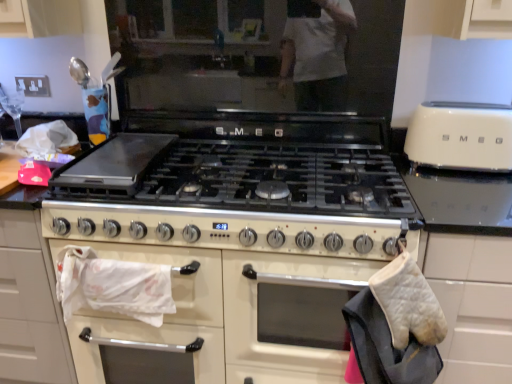
Question: Would you say white quilted oven mitt at right is a long distance from white glossy oven at center?

Choices:
 (A) yes
 (B) no

Answer: (B)

Question: Is white quilted oven mitt at right directly adjacent to white glossy oven at center?

Choices:
 (A) yes
 (B) no

Answer: (B)

Question: Is white quilted oven mitt at right closer to the viewer compared to white glossy oven at center?

Choices:
 (A) no
 (B) yes

Answer: (B)

Question: From the image's perspective, is white quilted oven mitt at right over white glossy oven at center?

Choices:
 (A) yes
 (B) no

Answer: (A)

Question: Is white quilted oven mitt at right shorter than white glossy oven at center?

Choices:
 (A) no
 (B) yes

Answer: (B)

Question: Relative to ivory matte toaster at right, is white glossy oven at center in front or behind?

Choices:
 (A) front
 (B) behind

Answer: (A)

Question: In terms of width, does white glossy oven at center look wider or thinner when compared to ivory matte toaster at right?

Choices:
 (A) wide
 (B) thin

Answer: (A)

Question: From a real-world perspective, is white glossy oven at center above or below ivory matte toaster at right?

Choices:
 (A) below
 (B) above

Answer: (A)

Question: In terms of height, does white glossy oven at center look taller or shorter compared to ivory matte toaster at right?

Choices:
 (A) tall
 (B) short

Answer: (A)

Question: Is white glossy oven at center bigger or smaller than white quilted oven mitt at right?

Choices:
 (A) small
 (B) big

Answer: (B)

Question: From a real-world perspective, is white glossy oven at center positioned above or below white quilted oven mitt at right?

Choices:
 (A) below
 (B) above

Answer: (A)

Question: In the image, is white glossy oven at center on the left side or the right side of white quilted oven mitt at right?

Choices:
 (A) right
 (B) left

Answer: (B)

Question: Is white glossy oven at center taller or shorter than white quilted oven mitt at right?

Choices:
 (A) tall
 (B) short

Answer: (A)

Question: From their relative heights in the image, would you say ivory matte toaster at right is taller or shorter than white quilted oven mitt at right?

Choices:
 (A) short
 (B) tall

Answer: (A)

Question: Considering the positions of point (497, 124) and point (399, 367), is point (497, 124) closer or farther from the camera than point (399, 367)?

Choices:
 (A) farther
 (B) closer

Answer: (A)